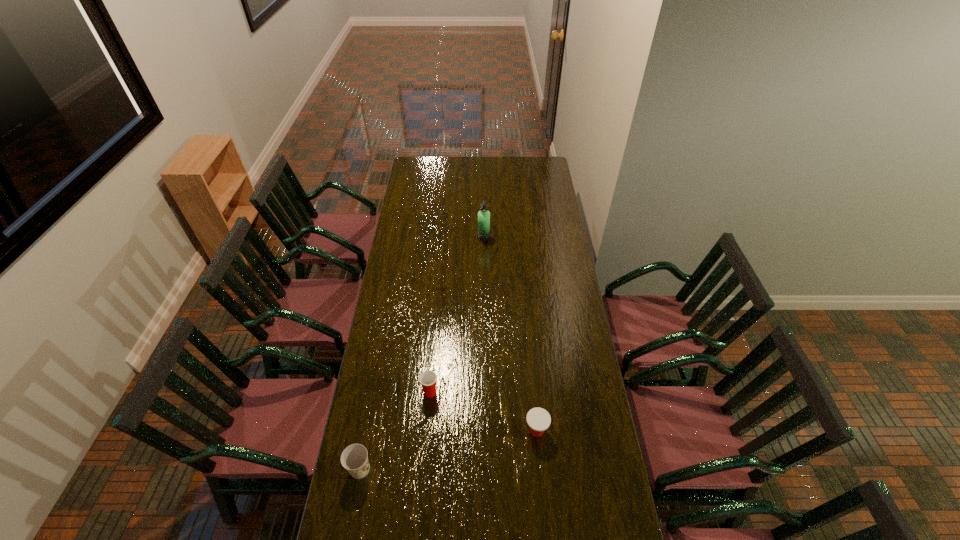
Identify the location of thermos bottle. (483, 215).

The image size is (960, 540). I want to click on the second object from right to left, so click(x=483, y=215).

Identify the location of the second Dixie cup from right to left. The image size is (960, 540). (428, 378).

Locate an element on the screen. Image resolution: width=960 pixels, height=540 pixels. the third object from right to left is located at coordinates (428, 378).

Where is `the nearest object`? The width and height of the screenshot is (960, 540). the nearest object is located at coordinates (x=354, y=458).

Find the location of a particular element. This screenshot has width=960, height=540. the leftmost Dixie cup is located at coordinates (354, 458).

Locate an element on the screen. The height and width of the screenshot is (540, 960). the rightmost Dixie cup is located at coordinates (538, 419).

I want to click on the shortest object, so click(x=538, y=419).

The image size is (960, 540). I want to click on free space located 0.380m on the back of the farthest object, so click(x=483, y=193).

The image size is (960, 540). Identify the location of free space located 0.190m on the back of the second object from left to right. (434, 345).